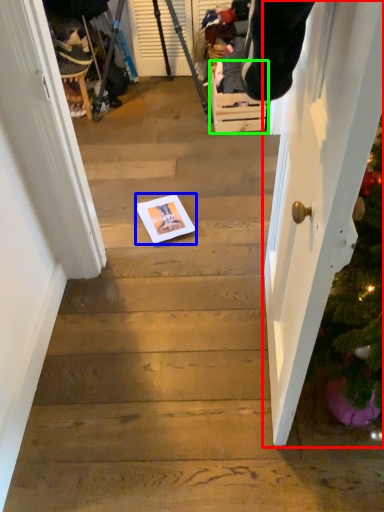
Question: Based on their relative distances, which object is farther from door (highlighted by a red box)? Choose from copy (highlighted by a blue box) and drawer (highlighted by a green box).

Choices:
 (A) copy
 (B) drawer

Answer: (B)